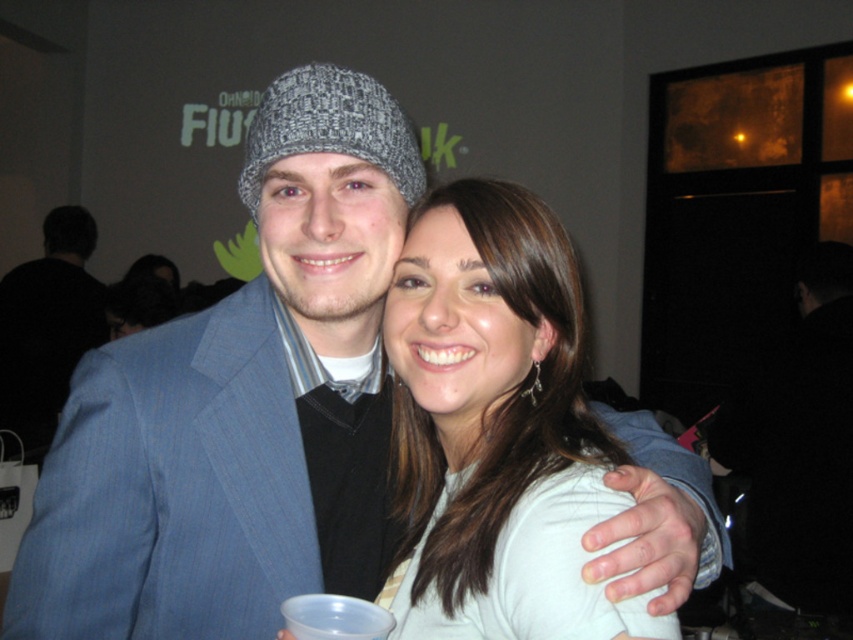
You are organizing a charity event and need to ensure that all donated clothing items fit into storage boxes. The storage boxes can only accommodate items with a width of 50 cm or less. You have a white matte shirt at center and a black fabric jacket at right to store. Based on their widths, which item will definitely fit into the box?

The white matte shirt at center has a width less than the black fabric jacket at right, so the white matte shirt at center will definitely fit into the storage box since its width is under 50 cm.

You are at a party and want to take a photo of the black fabric jacket at right and the matte gray beanie at left. Which object is positioned lower in the image?

The black fabric jacket at right is located below the matte gray beanie at left, so it is positioned lower in the image.

You are standing in front of the image and want to locate the black fabric jacket at right. Where would you find it in terms of horizontal and vertical position?

The black fabric jacket at right is located at the 2D coordinates point (799, 444), which means it is positioned approximately 69.5 percent from the left edge and 93.8 percent from the top edge of the image.